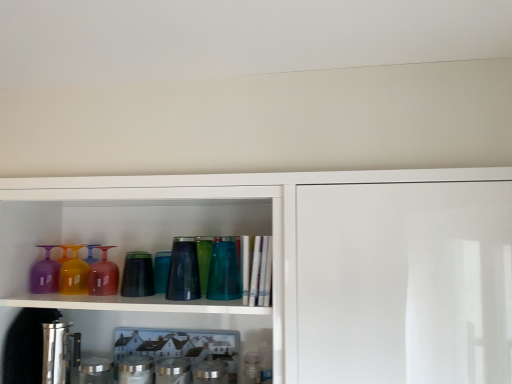
Where is `transparent glass cups at upper left`? transparent glass cups at upper left is located at coordinates (301, 264).

Describe the element at coordinates (301, 264) in the screenshot. I see `transparent glass cups at upper left` at that location.

Find the location of a particular element. transparent glass cups at upper left is located at coordinates (301, 264).